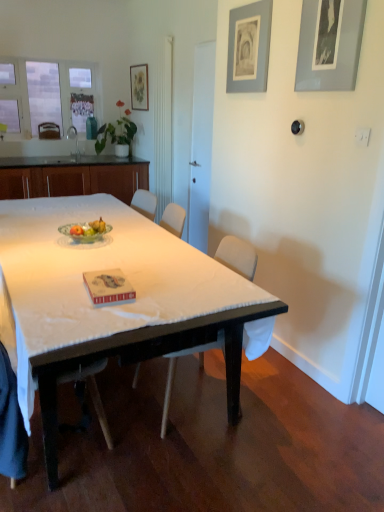
Question: Would you say wooden cabinet at left contains white wood chair at center, the third chair from the top?

Choices:
 (A) no
 (B) yes

Answer: (A)

Question: Is wooden cabinet at left to the right of white wood chair at center, placed as the second chair when sorted from right to left, from the viewer's perspective?

Choices:
 (A) no
 (B) yes

Answer: (A)

Question: Considering the relative sizes of wooden cabinet at left and white wood chair at center, the third chair from the top, in the image provided, is wooden cabinet at left thinner than white wood chair at center, the third chair from the top,?

Choices:
 (A) no
 (B) yes

Answer: (A)

Question: Is wooden cabinet at left wider than white wood chair at center, the 2th chair in the left-to-right sequence?

Choices:
 (A) yes
 (B) no

Answer: (A)

Question: From the image's perspective, is wooden cabinet at left below white wood chair at center, the 2th chair in the left-to-right sequence?

Choices:
 (A) yes
 (B) no

Answer: (B)

Question: In the image, is gray matte picture frame at upper right, positioned as the 1th picture frame in bottom-to-top order, positioned in front of or behind wooden at left, placed as the 1th chair when sorted from left to right?

Choices:
 (A) behind
 (B) front

Answer: (B)

Question: Considering the positions of gray matte picture frame at upper right, the first picture frame viewed from the front, and wooden at left, which is the 3th chair in bottom-to-top order, in the image, is gray matte picture frame at upper right, the first picture frame viewed from the front, wider or thinner than wooden at left, which is the 3th chair in bottom-to-top order,?

Choices:
 (A) thin
 (B) wide

Answer: (A)

Question: Based on their sizes in the image, would you say gray matte picture frame at upper right, which appears as the 3th picture frame when viewed from the top, is bigger or smaller than wooden at left, positioned as the 3th chair in front-to-back order?

Choices:
 (A) small
 (B) big

Answer: (A)

Question: From the image's perspective, is gray matte picture frame at upper right, acting as the 3th picture frame starting from the back, positioned above or below wooden at left, placed as the 1th chair when sorted from left to right?

Choices:
 (A) below
 (B) above

Answer: (A)

Question: Considering their positions, is white wood chair at center, the 1th chair in the front-to-back sequence, located in front of or behind green glass bowl at center?

Choices:
 (A) behind
 (B) front

Answer: (B)

Question: In terms of size, does white wood chair at center, the first chair from the bottom, appear bigger or smaller than green glass bowl at center?

Choices:
 (A) small
 (B) big

Answer: (B)

Question: Looking at their shapes, would you say white wood chair at center, marked as the third chair in a back-to-front arrangement, is wider or thinner than green glass bowl at center?

Choices:
 (A) wide
 (B) thin

Answer: (A)

Question: In the image, is white wood chair at center, marked as the third chair in a back-to-front arrangement, on the left side or the right side of green glass bowl at center?

Choices:
 (A) left
 (B) right

Answer: (A)

Question: Relative to matte floral print picture frame at upper center, which is counted as the first picture frame, starting from the left, is clear glass window at upper left in front or behind?

Choices:
 (A) behind
 (B) front

Answer: (B)

Question: In terms of width, does clear glass window at upper left look wider or thinner when compared to matte floral print picture frame at upper center, the first picture frame from the top?

Choices:
 (A) thin
 (B) wide

Answer: (B)